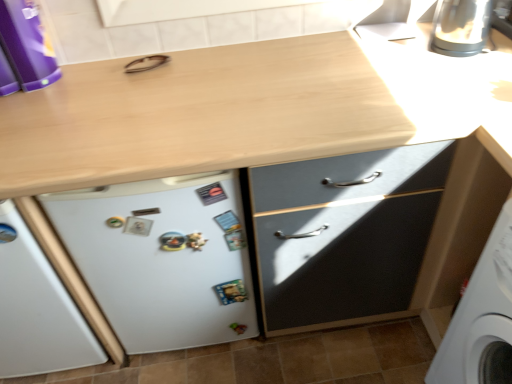
Question: Is satin silver kettle at upper right at the left side of purple plastic container at upper left?

Choices:
 (A) yes
 (B) no

Answer: (B)

Question: Can you confirm if satin silver kettle at upper right is positioned to the right of purple plastic container at upper left?

Choices:
 (A) yes
 (B) no

Answer: (A)

Question: Is satin silver kettle at upper right positioned with its back to purple plastic container at upper left?

Choices:
 (A) yes
 (B) no

Answer: (B)

Question: Is satin silver kettle at upper right outside purple plastic container at upper left?

Choices:
 (A) no
 (B) yes

Answer: (B)

Question: From the image's perspective, is satin silver kettle at upper right located beneath purple plastic container at upper left?

Choices:
 (A) yes
 (B) no

Answer: (B)

Question: Is point (24, 69) closer or farther from the camera than point (222, 332)?

Choices:
 (A) closer
 (B) farther

Answer: (A)

Question: From a real-world perspective, is purple plastic container at upper left above or below white matte refrigerator at lower left?

Choices:
 (A) below
 (B) above

Answer: (B)

Question: From the image's perspective, is purple plastic container at upper left above or below white matte refrigerator at lower left?

Choices:
 (A) below
 (B) above

Answer: (B)

Question: Do you think purple plastic container at upper left is within white matte refrigerator at lower left, or outside of it?

Choices:
 (A) inside
 (B) outside

Answer: (B)

Question: Is white matte refrigerator at lower left taller or shorter than purple plastic container at upper left?

Choices:
 (A) tall
 (B) short

Answer: (A)

Question: Considering the positions of white matte refrigerator at lower left and purple plastic container at upper left in the image, is white matte refrigerator at lower left wider or thinner than purple plastic container at upper left?

Choices:
 (A) wide
 (B) thin

Answer: (B)

Question: Do you think white matte refrigerator at lower left is within purple plastic container at upper left, or outside of it?

Choices:
 (A) outside
 (B) inside

Answer: (A)

Question: Considering their positions, is white matte refrigerator at lower left located in front of or behind purple plastic container at upper left?

Choices:
 (A) behind
 (B) front

Answer: (A)

Question: Looking at their shapes, would you say satin silver kettle at upper right is wider or thinner than white matte refrigerator at lower left?

Choices:
 (A) thin
 (B) wide

Answer: (B)

Question: Is satin silver kettle at upper right in front of or behind white matte refrigerator at lower left in the image?

Choices:
 (A) behind
 (B) front

Answer: (A)